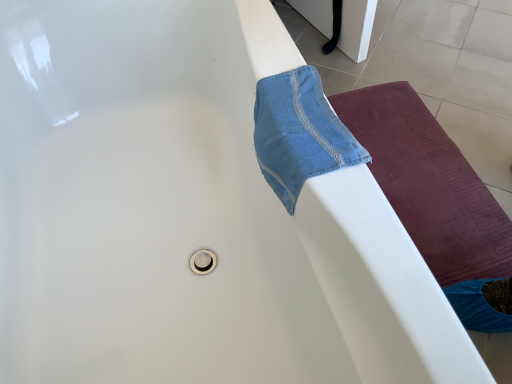
You are a GUI agent. You are given a task and a screenshot of the screen. Output one action in this format:
    pyautogui.click(x=<x>, y=<y>)
    Task: Click on the vacant area in front of blue cotton towel at upper right
    This screenshot has height=384, width=512.
    Given the screenshot: What is the action you would take?
    pyautogui.click(x=346, y=197)